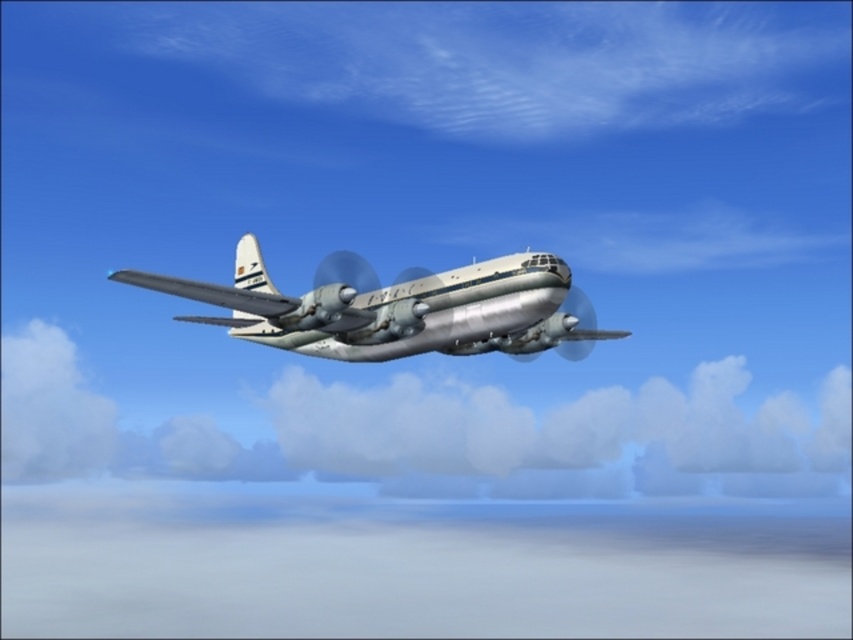
Question: Which point is farther to the camera?

Choices:
 (A) (563, 320)
 (B) (724, 438)

Answer: (B)

Question: Can you confirm if white fluffy cloud at center is positioned below silver metallic airplane at center?

Choices:
 (A) no
 (B) yes

Answer: (B)

Question: Does white fluffy cloud at center appear under silver metallic airplane at center?

Choices:
 (A) no
 (B) yes

Answer: (B)

Question: Observing the image, what is the correct spatial positioning of white fluffy cloud at center in reference to silver metallic airplane at center?

Choices:
 (A) left
 (B) right

Answer: (A)

Question: Which point is closer to the camera?

Choices:
 (A) (589, 428)
 (B) (468, 330)

Answer: (B)